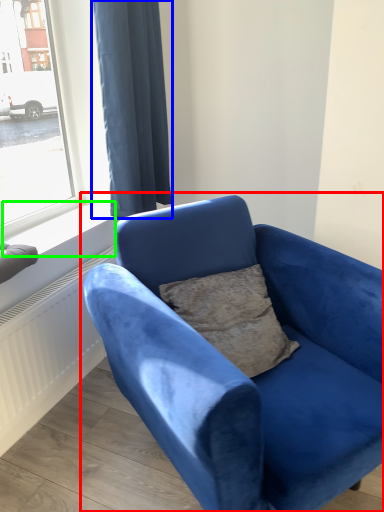
Question: Estimate the real-world distances between objects in this image. Which object is closer to studio couch (highlighted by a red box), curtain (highlighted by a blue box) or window sill (highlighted by a green box)?

Choices:
 (A) curtain
 (B) window sill

Answer: (B)